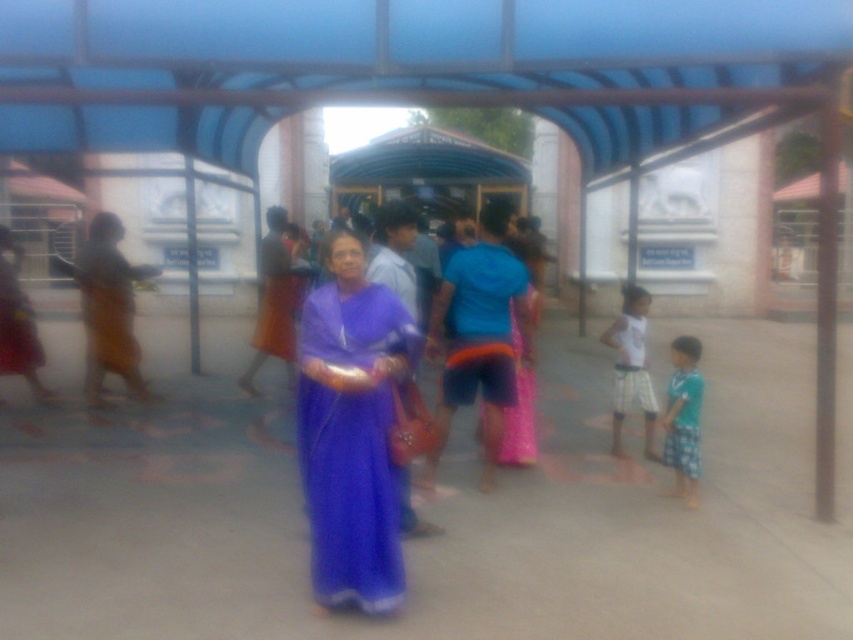
Where is the matte purple sari at center located in the image?

The matte purple sari at center is located at point (x=351, y=429) in the image.

You are standing at point (x=682, y=413) and want to walk to point (x=370, y=419). Which direction should you move relative to your current position?

You should move forward because point (x=370, y=419) is in front of point (x=682, y=413).